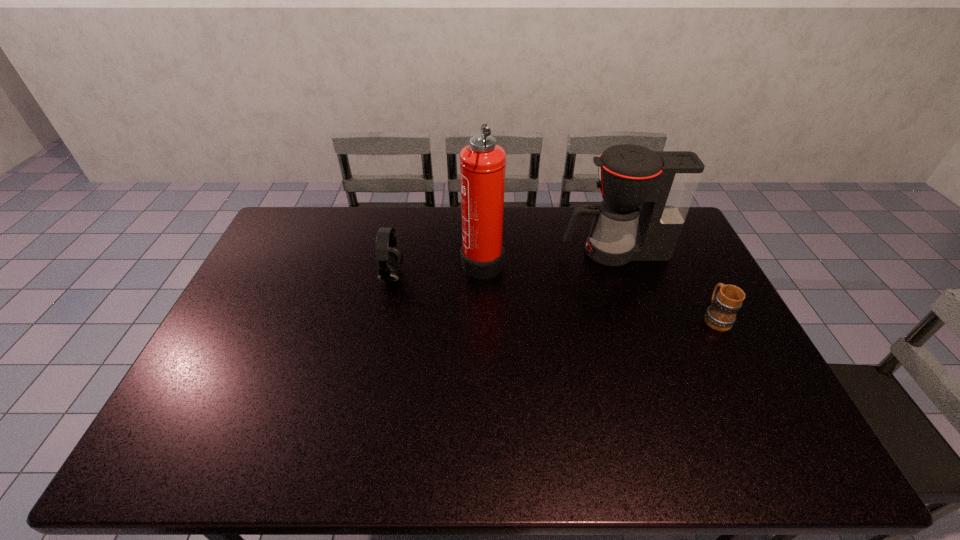
The image size is (960, 540). Find the location of `vacant area between the coffee maker and the shortest object`. vacant area between the coffee maker and the shortest object is located at coordinates (664, 285).

The width and height of the screenshot is (960, 540). I want to click on free point between the tallest object and the second shortest object, so click(x=437, y=268).

At what (x,y) coordinates should I click in order to perform the action: click on blank region between the fire extinguisher and the earphone. Please return your answer as a coordinate pair (x, y). The height and width of the screenshot is (540, 960). Looking at the image, I should click on (437, 268).

This screenshot has height=540, width=960. In order to click on free space between the coffee maker and the third object from right to left in this screenshot , I will do `click(548, 256)`.

This screenshot has width=960, height=540. Find the location of `vacant space that's between the mug and the leftmost object`. vacant space that's between the mug and the leftmost object is located at coordinates pos(553,297).

Identify the location of free space that is in between the second object from right to left and the fire extinguisher. The height and width of the screenshot is (540, 960). (548, 256).

The width and height of the screenshot is (960, 540). I want to click on the third closest object relative to the leftmost object, so [x=721, y=315].

You are a GUI agent. You are given a task and a screenshot of the screen. Output one action in this format:
    pyautogui.click(x=<x>, y=<y>)
    Task: Click on the object that is the second closest one to the second object from left to right
    Image resolution: width=960 pixels, height=540 pixels.
    Given the screenshot: What is the action you would take?
    pyautogui.click(x=664, y=183)

Where is `free spot that satisfies the following two spatial constraints: 1. on the front-facing side of the fire extinguisher; 2. on the side of the shortest object with the handle`? This screenshot has width=960, height=540. free spot that satisfies the following two spatial constraints: 1. on the front-facing side of the fire extinguisher; 2. on the side of the shortest object with the handle is located at coordinates (483, 318).

In order to click on free location that satisfies the following two spatial constraints: 1. on the side of the rightmost object with the handle; 2. on the front-facing side of the second object from left to right in this screenshot , I will do `click(685, 260)`.